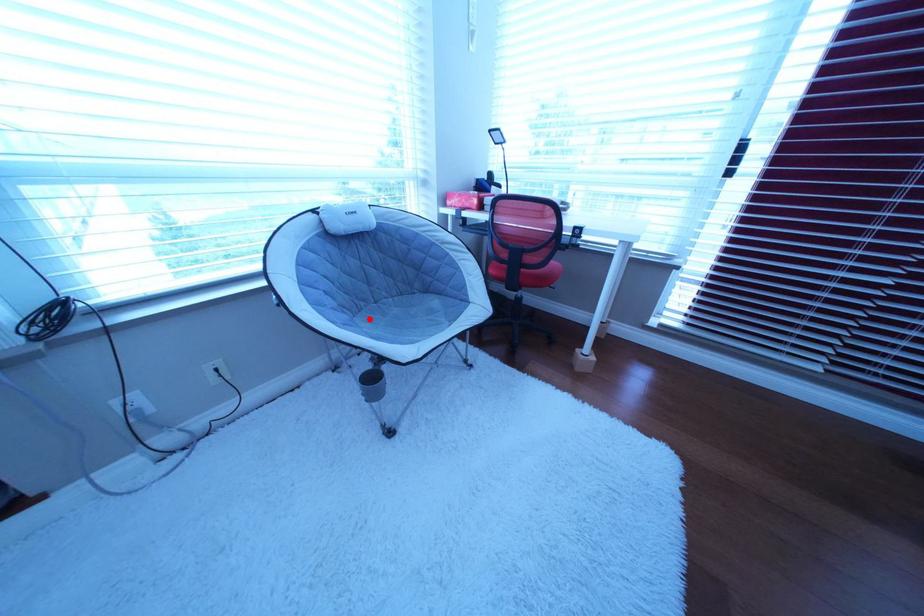
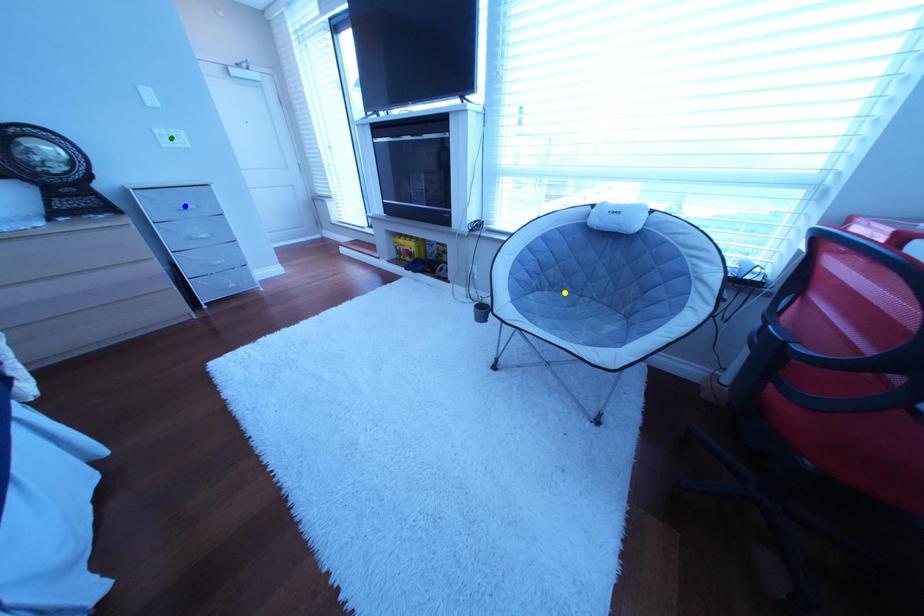
Question: I am providing you with two images of the same scene from different viewpoints. A red point is marked on the first image. You are given multiple points on the second image. Which point in image 2 represents the same 3d spot as the red point in image 1?

Choices:
 (A) blue point
 (B) green point
 (C) yellow point

Answer: (C)